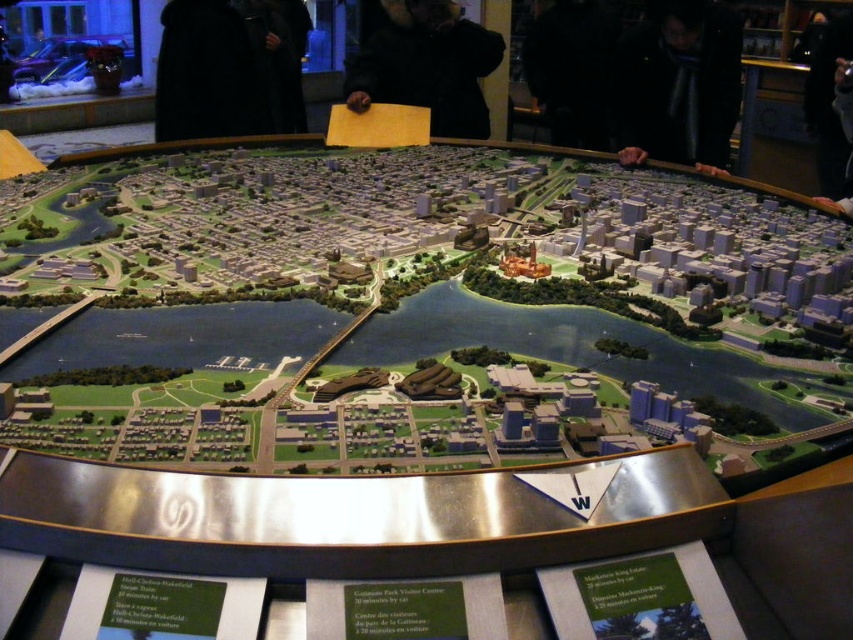
Who is more distant from viewer, (x=660, y=160) or (x=407, y=38)?

The point (x=407, y=38) is behind.

Based on the photo, does black matte jacket at upper center appear on the right side of black fuzzy coat at upper center?

Correct, you'll find black matte jacket at upper center to the right of black fuzzy coat at upper center.

Is point (660, 17) closer to viewer compared to point (434, 83)?

Yes, it is.

Find the location of a particular element. black matte jacket at upper center is located at coordinates (679, 83).